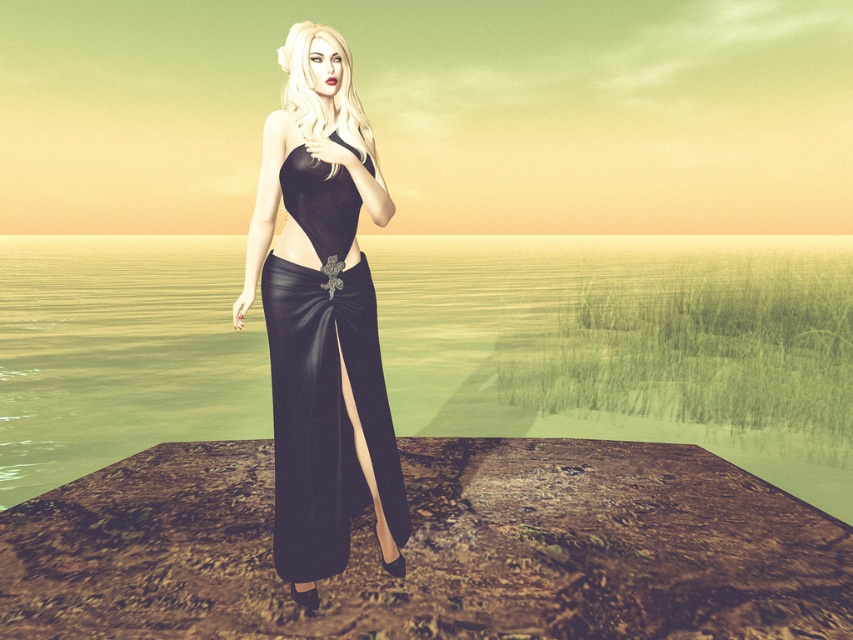
Question: Which of the following is the closest to the observer?

Choices:
 (A) [x=231, y=236]
 (B) [x=367, y=289]

Answer: (B)

Question: Can you confirm if glossy water at center is wider than satin black dress at center?

Choices:
 (A) no
 (B) yes

Answer: (B)

Question: Which point is closer to the camera?

Choices:
 (A) (444, 369)
 (B) (291, 204)

Answer: (B)

Question: From the image, what is the correct spatial relationship of glossy water at center in relation to satin black dress at center?

Choices:
 (A) right
 (B) left

Answer: (A)

Question: Does glossy water at center appear under satin black dress at center?

Choices:
 (A) yes
 (B) no

Answer: (B)

Question: Which of the following is the farthest from the observer?

Choices:
 (A) satin black dress at center
 (B) glossy water at center

Answer: (A)